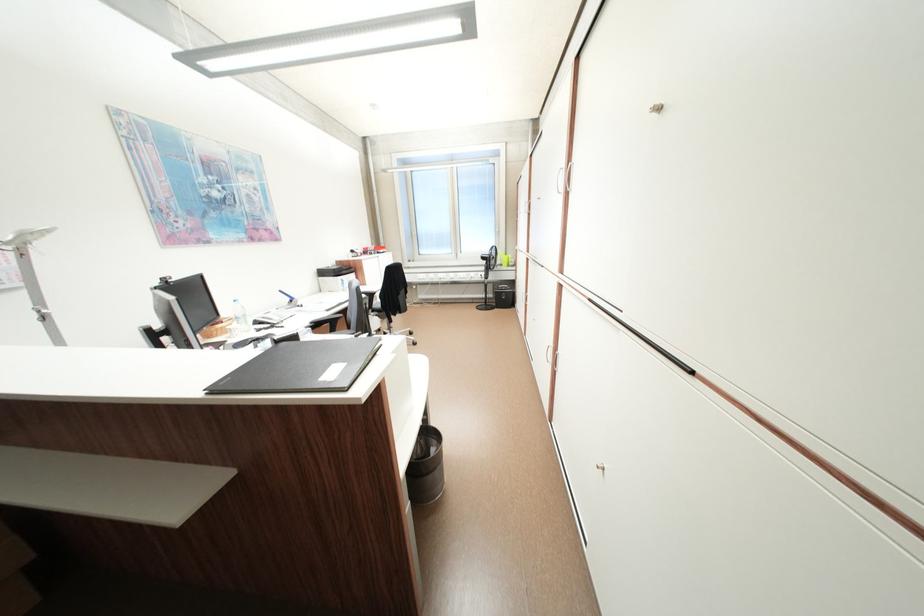
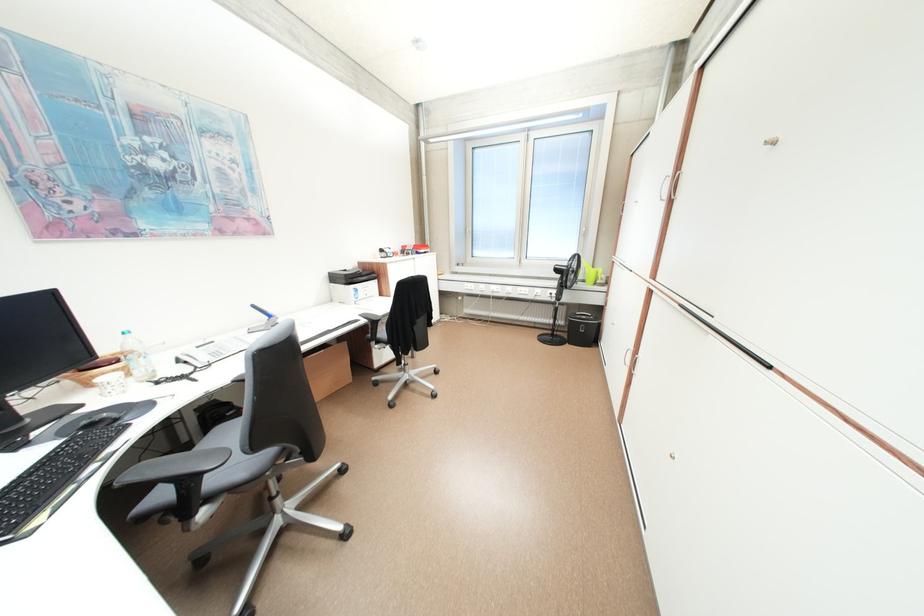
Where in the second image is the point corresponding to (504,305) from the first image?

(576, 337)